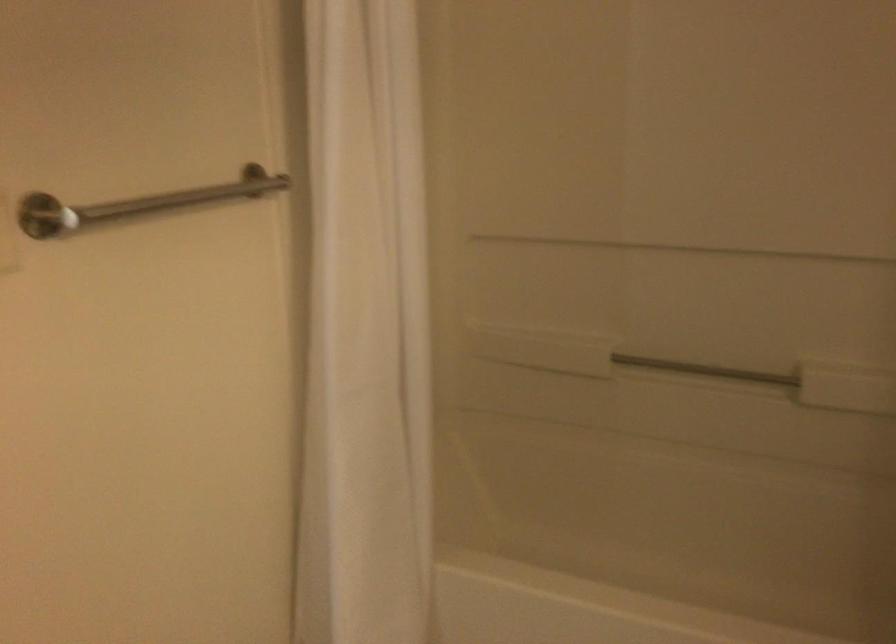
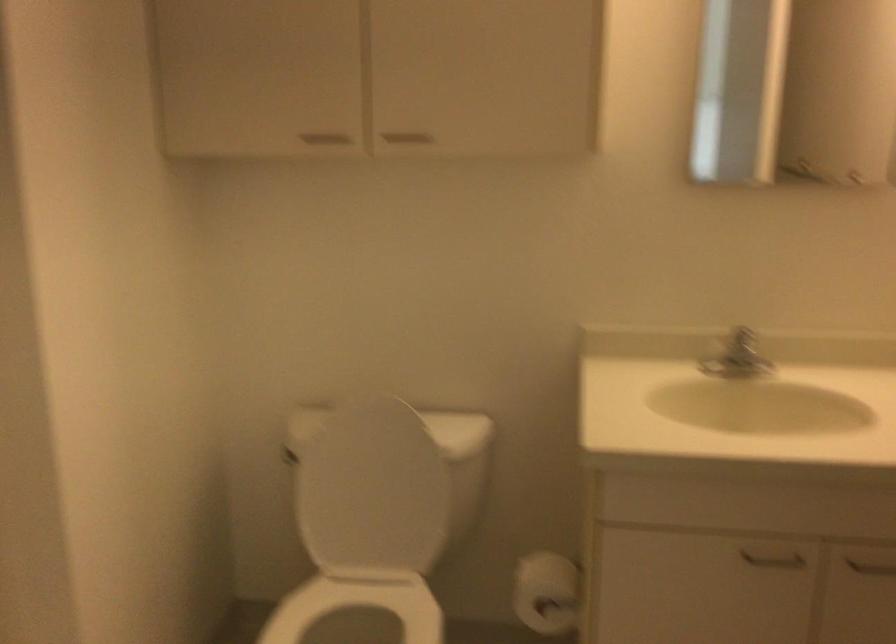
First-person continuous shooting, in which direction is the camera rotating?

The camera's rotation is toward right-down.